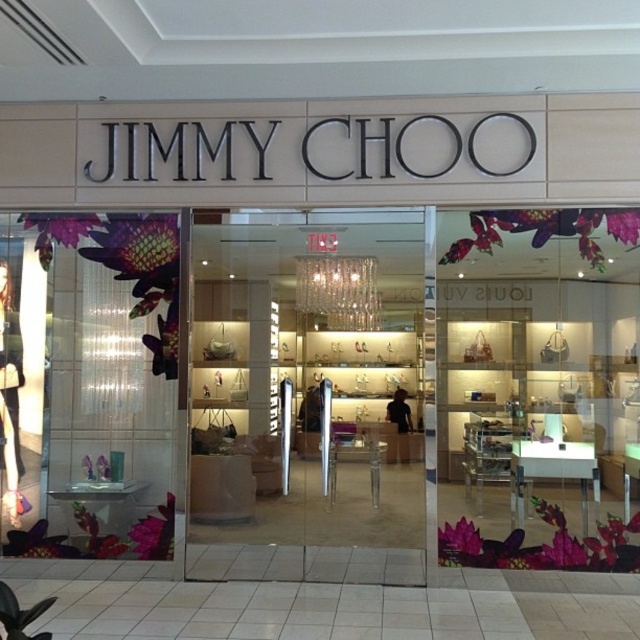
Between transparent glass door at center and translucent glass vase at left, which one appears on the right side from the viewer's perspective?

From the viewer's perspective, transparent glass door at center appears more on the right side.

Does transparent glass door at center appear over translucent glass vase at left?

Incorrect, transparent glass door at center is not positioned above translucent glass vase at left.

Locate an element on the screen. transparent glass door at center is located at coordinates (307, 396).

The image size is (640, 640). I want to click on transparent glass door at center, so click(307, 396).